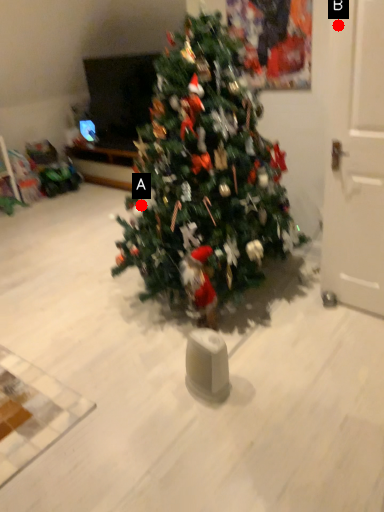
Question: Two points are circled on the image, labeled by A and B beside each circle. Among these points, which one is farthest from the camera?

Choices:
 (A) A is further
 (B) B is further

Answer: (A)